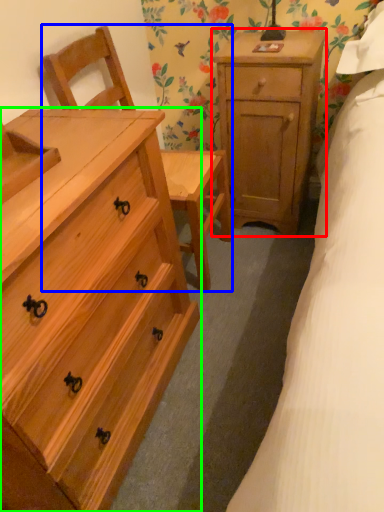
Question: Considering the real-world distances, which object is closest to nightstand (highlighted by a red box)? armchair (highlighted by a blue box) or chest of drawers (highlighted by a green box).

Choices:
 (A) armchair
 (B) chest of drawers

Answer: (A)